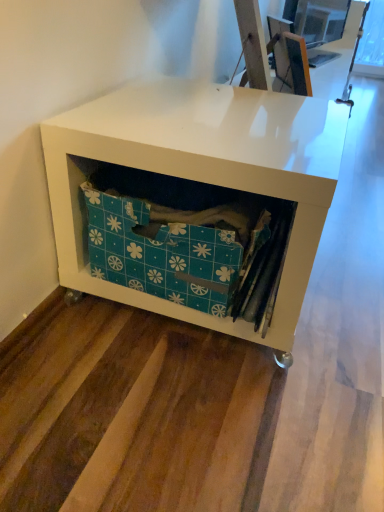
Question: Would you say teal fabric storage box at center is outside white matte storage unit at lower left?

Choices:
 (A) no
 (B) yes

Answer: (A)

Question: Is teal fabric storage box at center not close to white matte storage unit at lower left?

Choices:
 (A) no
 (B) yes

Answer: (A)

Question: From a real-world perspective, is teal fabric storage box at center on top of white matte storage unit at lower left?

Choices:
 (A) no
 (B) yes

Answer: (B)

Question: Can you confirm if teal fabric storage box at center is shorter than white matte storage unit at lower left?

Choices:
 (A) yes
 (B) no

Answer: (A)

Question: Does teal fabric storage box at center have a lesser width compared to white matte storage unit at lower left?

Choices:
 (A) yes
 (B) no

Answer: (A)

Question: Is teal fabric storage box at center oriented away from white matte storage unit at lower left?

Choices:
 (A) yes
 (B) no

Answer: (A)

Question: Are white matte storage unit at lower left and teal fabric storage box at center located far from each other?

Choices:
 (A) yes
 (B) no

Answer: (B)

Question: From the image's perspective, is white matte storage unit at lower left under teal fabric storage box at center?

Choices:
 (A) no
 (B) yes

Answer: (A)

Question: From the image's perspective, is white matte storage unit at lower left above teal fabric storage box at center?

Choices:
 (A) yes
 (B) no

Answer: (A)

Question: Does white matte storage unit at lower left touch teal fabric storage box at center?

Choices:
 (A) no
 (B) yes

Answer: (A)

Question: From a real-world perspective, is white matte storage unit at lower left located higher than teal fabric storage box at center?

Choices:
 (A) yes
 (B) no

Answer: (B)

Question: Considering the relative sizes of white matte storage unit at lower left and teal fabric storage box at center in the image provided, is white matte storage unit at lower left smaller than teal fabric storage box at center?

Choices:
 (A) no
 (B) yes

Answer: (A)

Question: From a real-world perspective, relative to white matte storage unit at lower left, is teal fabric storage box at center vertically above or below?

Choices:
 (A) above
 (B) below

Answer: (A)